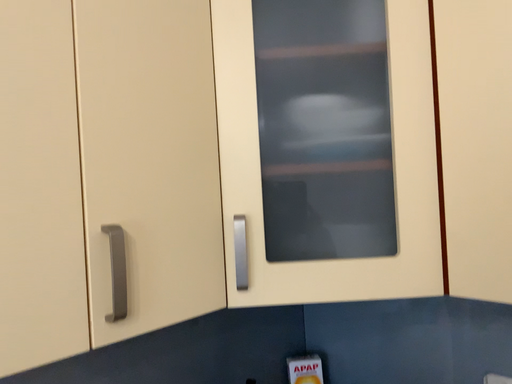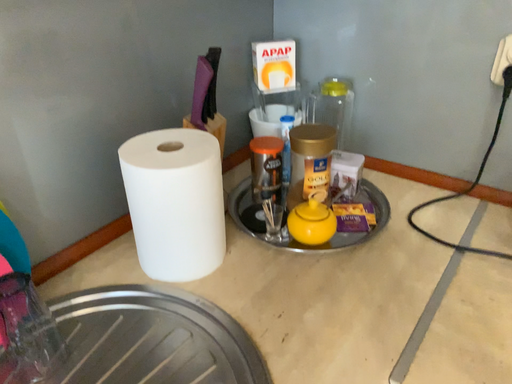
Question: How did the camera likely rotate when shooting the video?

Choices:
 (A) rotated left
 (B) rotated right

Answer: (B)